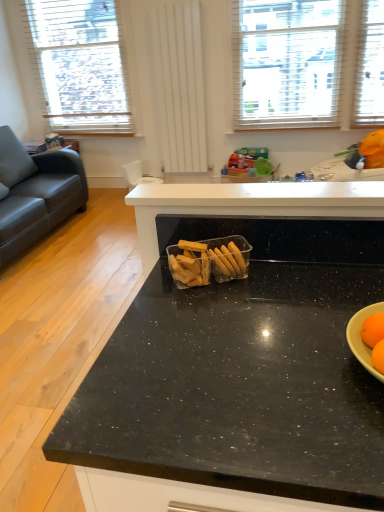
Question: Does white textured window at upper center, which is the 2th window in left-to-right order, lie behind translucent plastic container of crackers at center?

Choices:
 (A) no
 (B) yes

Answer: (B)

Question: Does white textured window at upper center, which is the 2th window in left-to-right order, appear on the right side of translucent plastic container of crackers at center?

Choices:
 (A) yes
 (B) no

Answer: (A)

Question: Can you confirm if white textured window at upper center, the first window when ordered from right to left, is thinner than translucent plastic container of crackers at center?

Choices:
 (A) no
 (B) yes

Answer: (A)

Question: Can you confirm if white textured window at upper center, which is the 2th window in left-to-right order, is taller than translucent plastic container of crackers at center?

Choices:
 (A) no
 (B) yes

Answer: (B)

Question: From the image's perspective, does white textured window at upper center, which is the 2th window in left-to-right order, appear higher than translucent plastic container of crackers at center?

Choices:
 (A) yes
 (B) no

Answer: (A)

Question: Are white textured window at upper center, the first window when ordered from right to left, and translucent plastic container of crackers at center making contact?

Choices:
 (A) yes
 (B) no

Answer: (B)

Question: Can you confirm if translucent plastic container of crackers at center is wider than white wooden blinds at upper left, which is the second window from right to left?

Choices:
 (A) no
 (B) yes

Answer: (A)

Question: Is translucent plastic container of crackers at center shorter than white wooden blinds at upper left, acting as the first window starting from the left?

Choices:
 (A) yes
 (B) no

Answer: (A)

Question: Is translucent plastic container of crackers at center looking in the opposite direction of white wooden blinds at upper left, acting as the first window starting from the left?

Choices:
 (A) yes
 (B) no

Answer: (B)

Question: Is white wooden blinds at upper left, which is the second window from right to left, located within translucent plastic container of crackers at center?

Choices:
 (A) yes
 (B) no

Answer: (B)

Question: Does translucent plastic container of crackers at center have a lesser width compared to white wooden blinds at upper left, which is the second window from right to left?

Choices:
 (A) yes
 (B) no

Answer: (A)

Question: From the image's perspective, is translucent plastic container of crackers at center below white wooden blinds at upper left, which is the second window from right to left?

Choices:
 (A) no
 (B) yes

Answer: (B)

Question: Considering the relative sizes of white wooden blinds at upper left, which is the second window from right to left, and white textured window at upper center, which is the 2th window in left-to-right order, in the image provided, is white wooden blinds at upper left, which is the second window from right to left, shorter than white textured window at upper center, which is the 2th window in left-to-right order,?

Choices:
 (A) yes
 (B) no

Answer: (B)